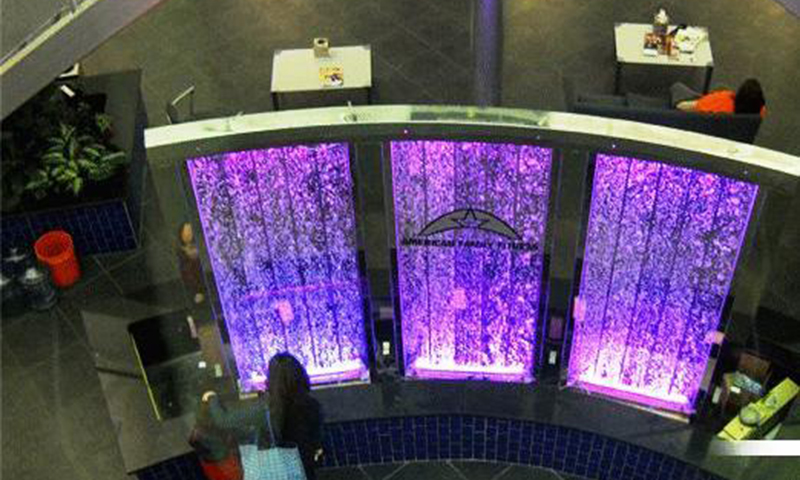
Where is `chair`? The image size is (800, 480). chair is located at coordinates (180, 110), (777, 349).